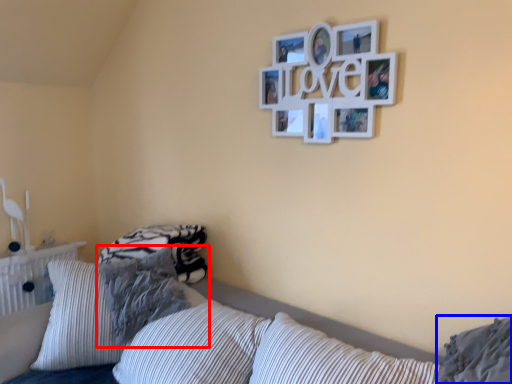
Question: Among these objects, which one is farthest to the camera, pillow (highlighted by a red box) or pillow (highlighted by a blue box)?

Choices:
 (A) pillow
 (B) pillow

Answer: (A)